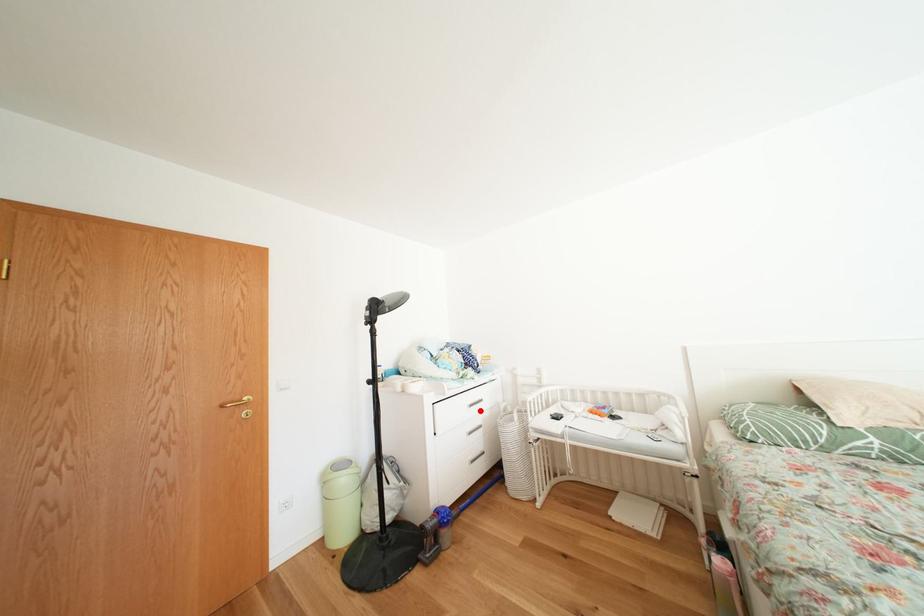
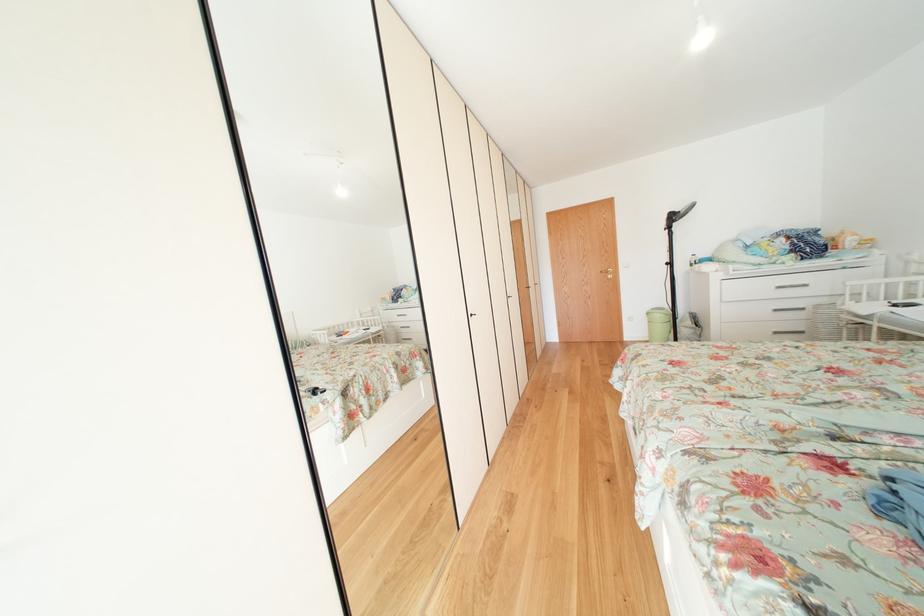
Question: I am providing you with two images of the same scene from different viewpoints. A red point is shown in image1. For the corresponding object point in image2, is it positioned nearer or farther from the camera?

Choices:
 (A) Nearer
 (B) Farther

Answer: (A)